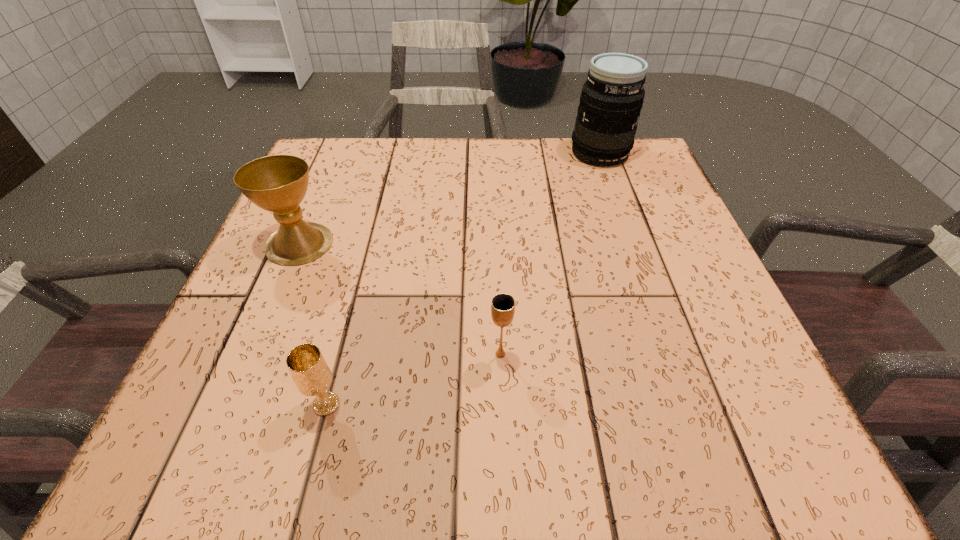
Locate an element on the screen. This screenshot has width=960, height=540. the farthest object is located at coordinates (612, 97).

Find the location of a particular element. The width and height of the screenshot is (960, 540). the rightmost object is located at coordinates (612, 97).

Locate an element on the screen. This screenshot has width=960, height=540. the leftmost object is located at coordinates (278, 183).

You are a GUI agent. You are given a task and a screenshot of the screen. Output one action in this format:
    pyautogui.click(x=<x>, y=<y>)
    Task: Click on the leftmost chalice
    The height and width of the screenshot is (540, 960).
    Given the screenshot: What is the action you would take?
    pyautogui.click(x=278, y=183)

Where is `the second nearest chalice`? This screenshot has height=540, width=960. the second nearest chalice is located at coordinates (503, 305).

Identify the location of the third object from left to right. (503, 305).

Identify the location of the nearest object. (308, 368).

The height and width of the screenshot is (540, 960). In order to click on the second object from left to right in this screenshot , I will do `click(308, 368)`.

Find the location of `vacant space situated 0.070m on the front of the tallest object`. vacant space situated 0.070m on the front of the tallest object is located at coordinates (612, 185).

Identify the location of vacant space located on the right of the farthest chalice. (410, 243).